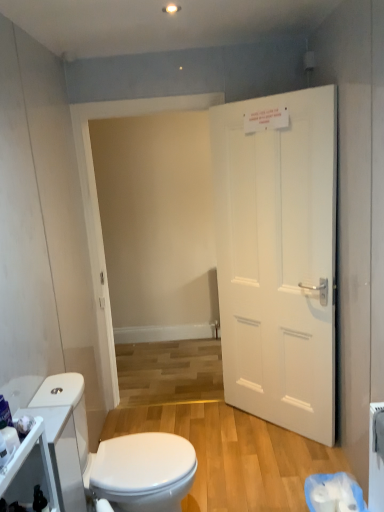
Question: Is white glossy toilet at lower left facing towards white glossy cabinet at lower left?

Choices:
 (A) no
 (B) yes

Answer: (A)

Question: Considering the relative sizes of white glossy toilet at lower left and white glossy cabinet at lower left in the image provided, is white glossy toilet at lower left shorter than white glossy cabinet at lower left?

Choices:
 (A) yes
 (B) no

Answer: (B)

Question: From the image's perspective, is white glossy toilet at lower left over white glossy cabinet at lower left?

Choices:
 (A) yes
 (B) no

Answer: (B)

Question: Considering the relative positions of white glossy toilet at lower left and white glossy cabinet at lower left in the image provided, is white glossy toilet at lower left to the right of white glossy cabinet at lower left from the viewer's perspective?

Choices:
 (A) yes
 (B) no

Answer: (A)

Question: Can you confirm if white glossy toilet at lower left is bigger than white glossy cabinet at lower left?

Choices:
 (A) yes
 (B) no

Answer: (A)

Question: From the image's perspective, is white glossy cabinet at lower left above or below white matte door at right?

Choices:
 (A) below
 (B) above

Answer: (A)

Question: Would you say white glossy cabinet at lower left is inside or outside white matte door at right?

Choices:
 (A) outside
 (B) inside

Answer: (A)

Question: Is white glossy cabinet at lower left wider or thinner than white matte door at right?

Choices:
 (A) wide
 (B) thin

Answer: (A)

Question: From their relative heights in the image, would you say white glossy cabinet at lower left is taller or shorter than white matte door at right?

Choices:
 (A) short
 (B) tall

Answer: (A)

Question: Is white matte door at right situated inside white glossy toilet at lower left or outside?

Choices:
 (A) inside
 (B) outside

Answer: (B)

Question: Looking at their shapes, would you say white matte door at right is wider or thinner than white glossy toilet at lower left?

Choices:
 (A) thin
 (B) wide

Answer: (A)

Question: Visually, is white matte door at right positioned to the left or to the right of white glossy toilet at lower left?

Choices:
 (A) right
 (B) left

Answer: (A)

Question: Considering the positions of white matte door at right and white glossy toilet at lower left in the image, is white matte door at right taller or shorter than white glossy toilet at lower left?

Choices:
 (A) tall
 (B) short

Answer: (A)

Question: Considering the positions of point (99, 494) and point (36, 430), is point (99, 494) closer or farther from the camera than point (36, 430)?

Choices:
 (A) farther
 (B) closer

Answer: (A)

Question: From a real-world perspective, relative to white glossy cabinet at lower left, is white glossy toilet at lower left vertically above or below?

Choices:
 (A) below
 (B) above

Answer: (A)